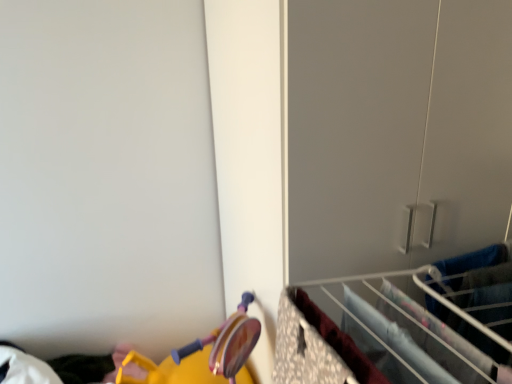
Question: Considering the relative sizes of metal wire rack at lower right, the first closet when ordered from left to right, and floral fabric drawer at lower right in the image provided, is metal wire rack at lower right, the first closet when ordered from left to right, thinner than floral fabric drawer at lower right?

Choices:
 (A) yes
 (B) no

Answer: (B)

Question: Is the position of metal wire rack at lower right, marked as the second closet in a top-to-bottom arrangement, more distant than that of floral fabric drawer at lower right?

Choices:
 (A) yes
 (B) no

Answer: (A)

Question: From the image's perspective, does metal wire rack at lower right, the first closet when ordered from left to right, appear lower than floral fabric drawer at lower right?

Choices:
 (A) yes
 (B) no

Answer: (B)

Question: Can you confirm if metal wire rack at lower right, the first closet ordered from the bottom, is smaller than floral fabric drawer at lower right?

Choices:
 (A) yes
 (B) no

Answer: (A)

Question: Is floral fabric drawer at lower right located within metal wire rack at lower right, marked as the second closet in a top-to-bottom arrangement?

Choices:
 (A) no
 (B) yes

Answer: (A)

Question: Is point (297, 349) positioned closer to the camera than point (368, 223)?

Choices:
 (A) closer
 (B) farther

Answer: (A)

Question: From a real-world perspective, relative to matte gray closet at center-right, the first closet in the right-to-left sequence, is floral fabric drawer at lower right vertically above or below?

Choices:
 (A) above
 (B) below

Answer: (A)

Question: From their relative heights in the image, would you say floral fabric drawer at lower right is taller or shorter than matte gray closet at center-right, the second closet from the left?

Choices:
 (A) short
 (B) tall

Answer: (A)

Question: Is floral fabric drawer at lower right bigger or smaller than matte gray closet at center-right, the second closet from the left?

Choices:
 (A) small
 (B) big

Answer: (A)

Question: Considering the positions of point (370, 306) and point (480, 81), is point (370, 306) closer or farther from the camera than point (480, 81)?

Choices:
 (A) closer
 (B) farther

Answer: (A)

Question: From the image's perspective, is metal wire rack at lower right, marked as the second closet in a top-to-bottom arrangement, above or below matte gray closet at center-right, acting as the 2th closet starting from the bottom?

Choices:
 (A) above
 (B) below

Answer: (B)

Question: Considering the positions of metal wire rack at lower right, the first closet when ordered from left to right, and matte gray closet at center-right, the first closet in the right-to-left sequence, in the image, is metal wire rack at lower right, the first closet when ordered from left to right, bigger or smaller than matte gray closet at center-right, the first closet in the right-to-left sequence,?

Choices:
 (A) small
 (B) big

Answer: (A)

Question: Do you think metal wire rack at lower right, the first closet ordered from the bottom, is within matte gray closet at center-right, the 1th closet when ordered from top to bottom, or outside of it?

Choices:
 (A) outside
 (B) inside

Answer: (A)

Question: In the image, is metal wire rack at lower right, the first closet ordered from the bottom, on the left side or the right side of floral fabric drawer at lower right?

Choices:
 (A) left
 (B) right

Answer: (B)

Question: Is metal wire rack at lower right, the 2th closet from the right, situated inside floral fabric drawer at lower right or outside?

Choices:
 (A) inside
 (B) outside

Answer: (B)